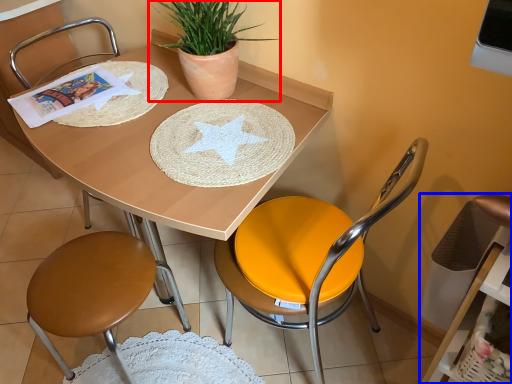
Question: Which object is further to the camera taking this photo, houseplant (highlighted by a red box) or swivel chair (highlighted by a blue box)?

Choices:
 (A) houseplant
 (B) swivel chair

Answer: (A)